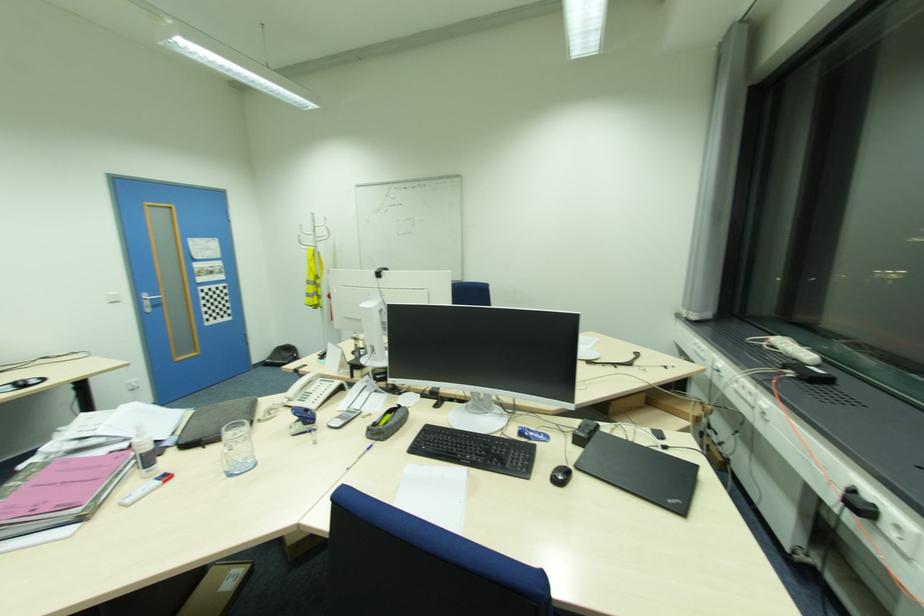
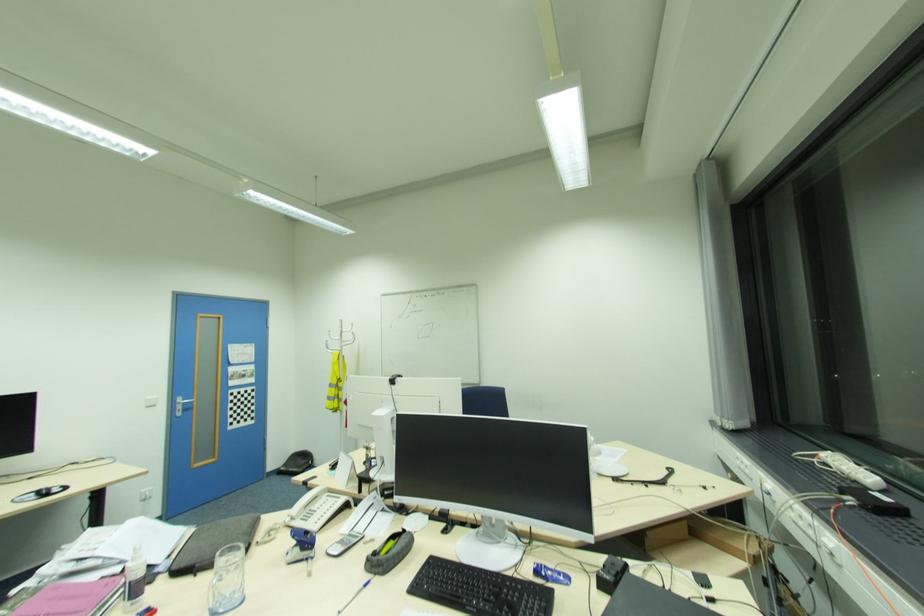
Find the pixel in the second image that matches point 147,297 in the first image.

(180, 400)